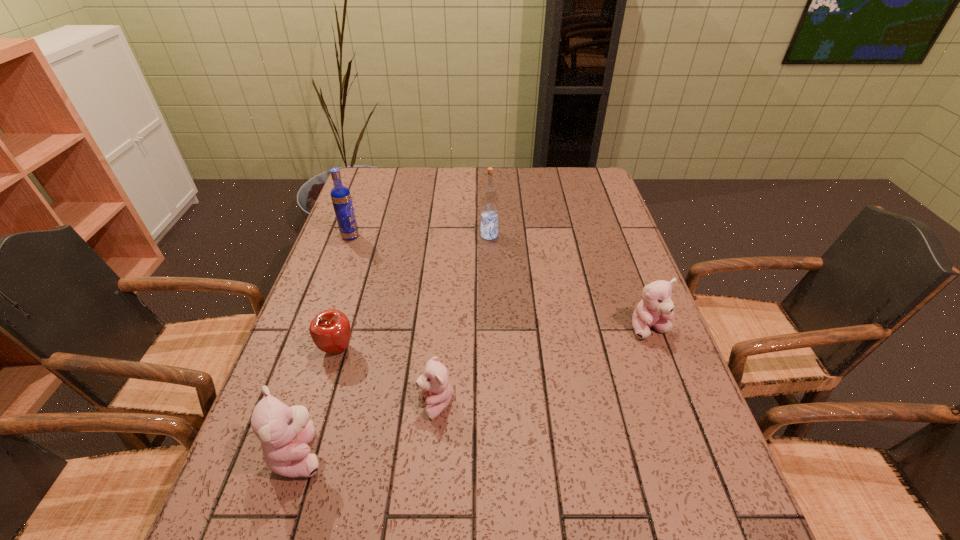
Image resolution: width=960 pixels, height=540 pixels. What are the coordinates of `free space for an extra teddy_bear to achieve even spacing` in the screenshot? It's located at (551, 363).